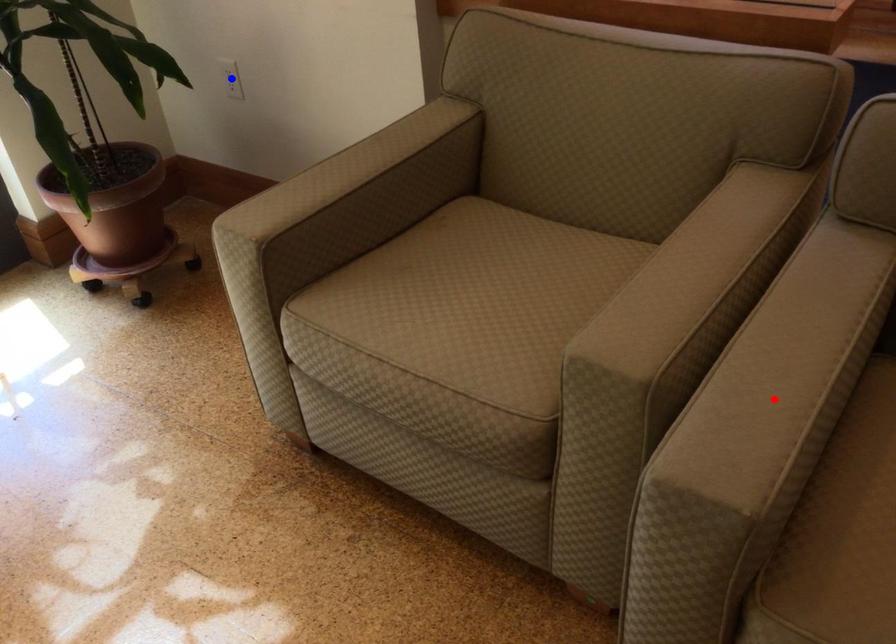
Question: Which of the two points in the image is closer to the camera?

Choices:
 (A) Blue point is closer.
 (B) Red point is closer.

Answer: (B)